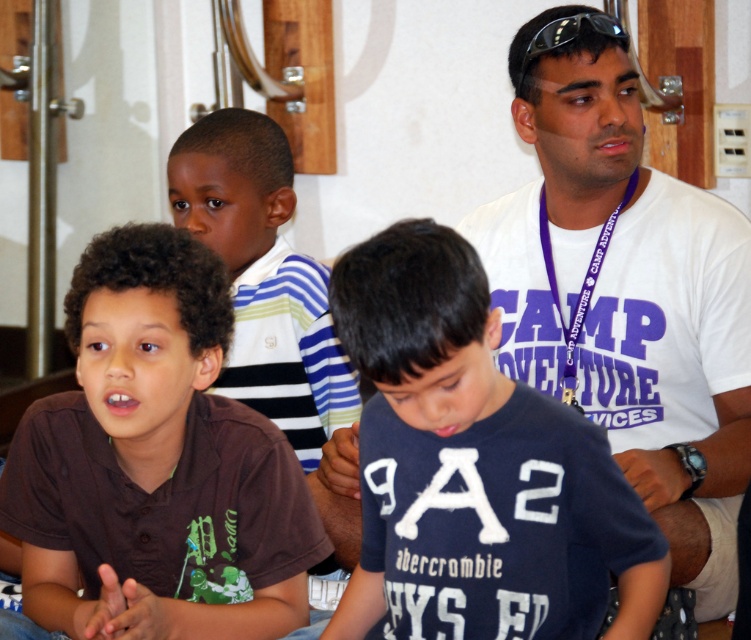
Is point (626, 88) less distant than point (372, 316)?

No, it is not.

Does white cotton t-shirt at center appear over dark blue cotton shirt at center?

Yes, white cotton t-shirt at center is above dark blue cotton shirt at center.

Locate an element on the screen. This screenshot has width=751, height=640. white cotton t-shirt at center is located at coordinates (626, 296).

Consider the image. Is brown cotton shirt at lower left smaller than white cotton t-shirt at center?

Correct, brown cotton shirt at lower left occupies less space than white cotton t-shirt at center.

Does brown cotton shirt at lower left have a greater height compared to white cotton t-shirt at center?

No, brown cotton shirt at lower left is not taller than white cotton t-shirt at center.

Who is more distant from viewer, (98, 557) or (674, 288)?

The point (674, 288) is more distant.

Find the location of `brown cotton shirt at lower left`. brown cotton shirt at lower left is located at coordinates (155, 464).

Does brown cotton shirt at lower left have a greater height compared to dark blue cotton shirt at center?

Yes, brown cotton shirt at lower left is taller than dark blue cotton shirt at center.

Identify the location of brown cotton shirt at lower left. (155, 464).

Describe the element at coordinates (155, 464) in the screenshot. I see `brown cotton shirt at lower left` at that location.

At what (x,y) coordinates should I click in order to perform the action: click on brown cotton shirt at lower left. Please return your answer as a coordinate pair (x, y). The image size is (751, 640). Looking at the image, I should click on (155, 464).